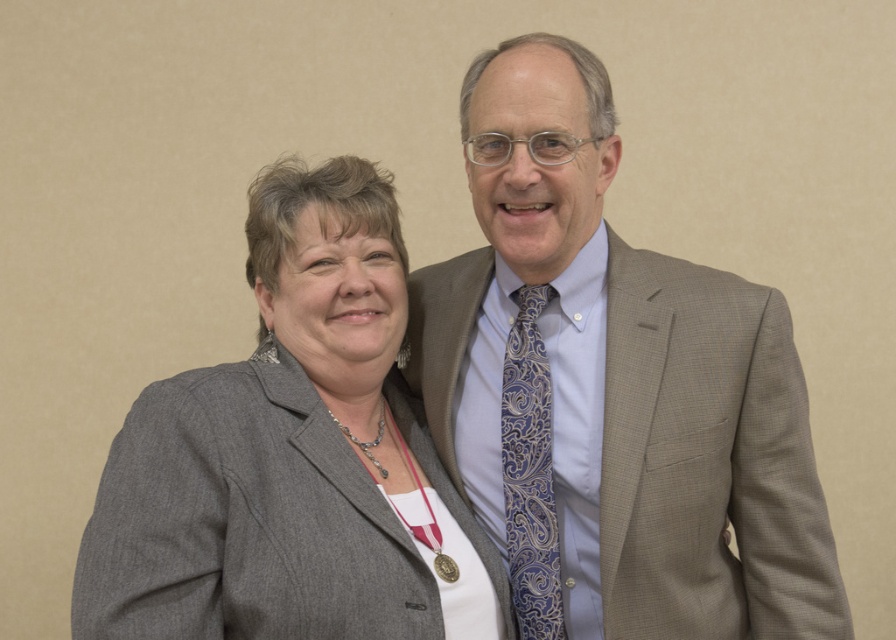
You are a tailor who needs to determine which item, the gray wool blazer at center or the blue paisley tie at center, requires more fabric for alterations. Based on their sizes, which one would need more fabric?

The gray wool blazer at center requires more fabric for alterations since its width is larger than the blue paisley tie at center.